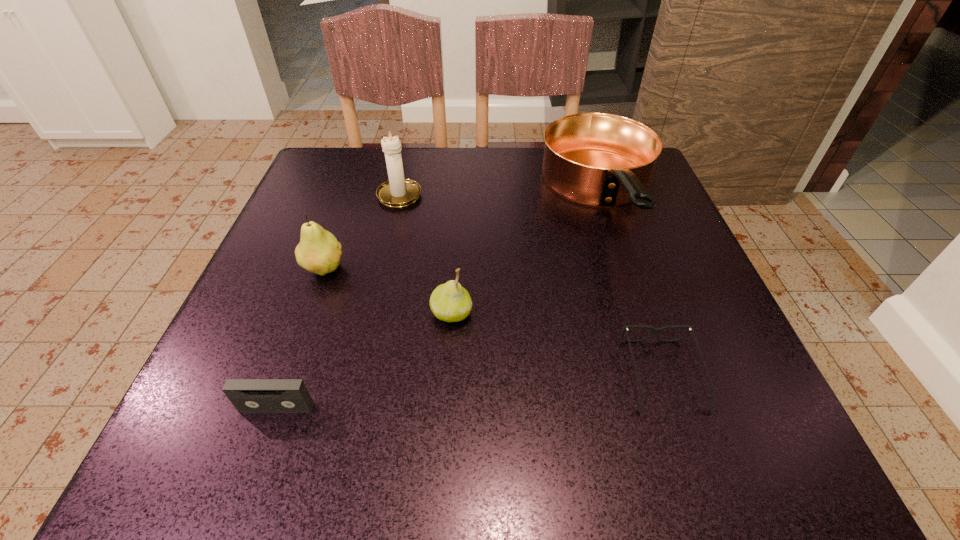
Where is `frying pan`? frying pan is located at coordinates (597, 159).

You are a GUI agent. You are given a task and a screenshot of the screen. Output one action in this format:
    pyautogui.click(x=<x>, y=<y>)
    Task: Click on the third object from left to right
    The height and width of the screenshot is (540, 960).
    Given the screenshot: What is the action you would take?
    pyautogui.click(x=397, y=192)

Where is `the farther pear`? the farther pear is located at coordinates (319, 252).

Identify the location of the right pear. This screenshot has width=960, height=540. (450, 302).

Where is `the fourth object from left to right`? the fourth object from left to right is located at coordinates (450, 302).

Identify the location of videotape. Image resolution: width=960 pixels, height=540 pixels. (247, 395).

Identify the location of the shortest object. This screenshot has width=960, height=540. (654, 330).

Where is `vacant space positioned 0.260m on the handle side of the frying pan`? vacant space positioned 0.260m on the handle side of the frying pan is located at coordinates (669, 399).

Where is `vacant area located on the handle side of the candle holder`? vacant area located on the handle side of the candle holder is located at coordinates (406, 167).

Where is `free space located on the handle side of the candle holder`? This screenshot has width=960, height=540. free space located on the handle side of the candle holder is located at coordinates (409, 151).